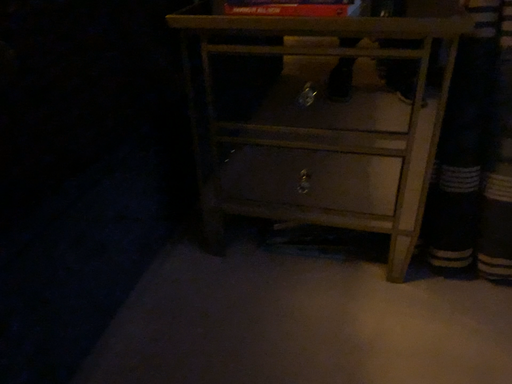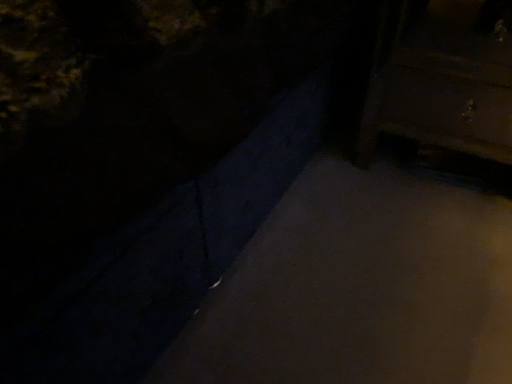
Question: Which way did the camera rotate in the video?

Choices:
 (A) rotated left
 (B) rotated right

Answer: (A)